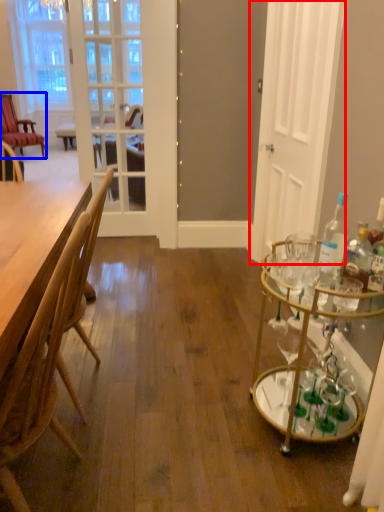
Question: Which object is closer to the camera taking this photo, door (highlighted by a red box) or chair (highlighted by a blue box)?

Choices:
 (A) door
 (B) chair

Answer: (A)